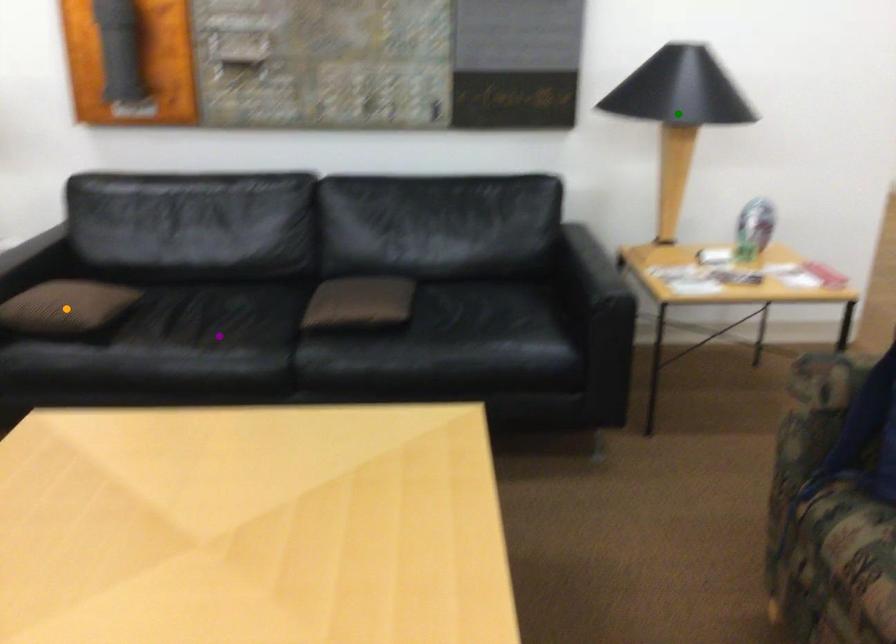
Order these from nearest to farthest:
orange point
purple point
green point

green point, purple point, orange point